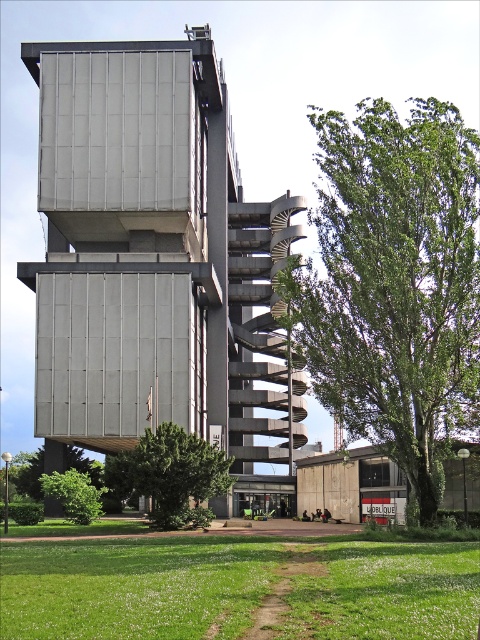
Question: Among these points, which one is farthest from the camera?

Choices:
 (A) (129, 609)
 (B) (104, 492)
 (C) (121, 465)
 (D) (105, 84)

Answer: (D)

Question: Estimate the real-world distances between objects in this image. Which object is closer to the green leafy tree at right?

Choices:
 (A) metallic gray building at center
 (B) green leafy tree at center
 (C) green leafy tree at lower left

Answer: (B)

Question: Is green grass at lower center above green leafy tree at lower left?

Choices:
 (A) no
 (B) yes

Answer: (B)

Question: In this image, where is metallic gray building at center located relative to green leafy tree at lower left?

Choices:
 (A) left
 (B) right

Answer: (B)

Question: Is metallic gray building at center smaller than green leafy tree at lower left?

Choices:
 (A) no
 (B) yes

Answer: (A)

Question: Which of the following is the closest to the observer?

Choices:
 (A) pos(48,477)
 (B) pos(250,337)

Answer: (A)